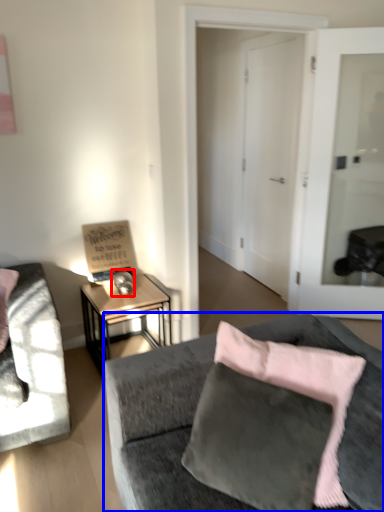
Question: Which object appears farthest to the camera in this image, table lamp (highlighted by a red box) or studio couch (highlighted by a blue box)?

Choices:
 (A) table lamp
 (B) studio couch

Answer: (A)